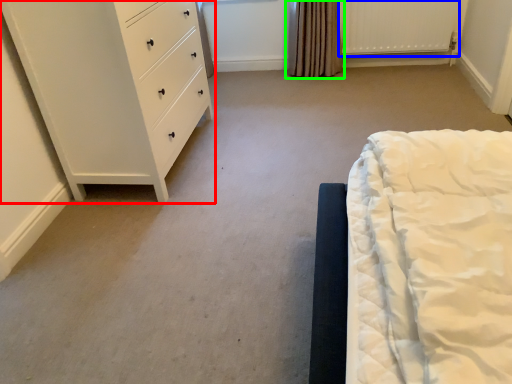
Question: Which is farther away from chest of drawers (highlighted by a red box)? radiator (highlighted by a blue box) or curtain (highlighted by a green box)?

Choices:
 (A) radiator
 (B) curtain

Answer: (A)